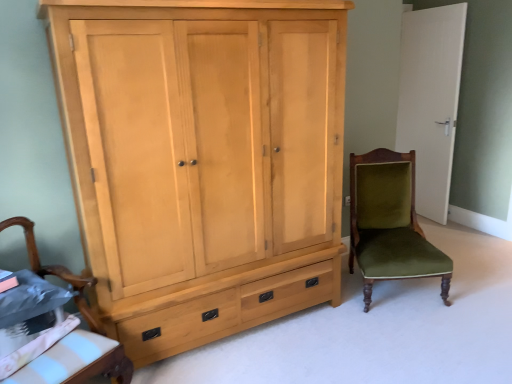
At what (x,y) coordinates should I click in order to perform the action: click on white matte door at upper right. Please return your answer as a coordinate pair (x, y). The image size is (512, 384). Looking at the image, I should click on (430, 100).

Describe the element at coordinates (203, 160) in the screenshot. The height and width of the screenshot is (384, 512). I see `light wood wardrobe at left` at that location.

The width and height of the screenshot is (512, 384). In order to click on white matte door at upper right in this screenshot , I will do `click(430, 100)`.

Looking at their sizes, would you say light wood wardrobe at left is wider or thinner than velvet green chair at right, placed as the second chair when sorted from left to right?

Clearly, light wood wardrobe at left has less width compared to velvet green chair at right, placed as the second chair when sorted from left to right.

Does light wood wardrobe at left have a greater height compared to velvet green chair at right, placed as the second chair when sorted from left to right?

Correct, light wood wardrobe at left is much taller as velvet green chair at right, placed as the second chair when sorted from left to right.

In the image, is light wood wardrobe at left positioned in front of or behind velvet green chair at right, the 1th chair positioned from the back?

In the image, light wood wardrobe at left appears in front of velvet green chair at right, the 1th chair positioned from the back.

From the image's perspective, is light wood wardrobe at left below velvet green chair at right, placed as the second chair when sorted from left to right?

No, from the image's perspective, light wood wardrobe at left is not below velvet green chair at right, placed as the second chair when sorted from left to right.

From a real-world perspective, does light wood wardrobe at left sit lower than wooden armchair at lower left, the 2th chair in the right-to-left sequence?

Incorrect, from a real-world perspective, light wood wardrobe at left is higher than wooden armchair at lower left, the 2th chair in the right-to-left sequence.

What's the angular difference between light wood wardrobe at left and wooden armchair at lower left, placed as the 2th chair when sorted from back to front,'s facing directions?

The angular difference between light wood wardrobe at left and wooden armchair at lower left, placed as the 2th chair when sorted from back to front, is 30 degrees.

Is the surface of light wood wardrobe at left in direct contact with wooden armchair at lower left, placed as the 2th chair when sorted from back to front?

light wood wardrobe at left and wooden armchair at lower left, placed as the 2th chair when sorted from back to front, are not in contact.

In the image, is light wood wardrobe at left positioned in front of or behind wooden armchair at lower left, the 2th chair in the right-to-left sequence?

Clearly, light wood wardrobe at left is behind wooden armchair at lower left, the 2th chair in the right-to-left sequence.

Considering the sizes of objects velvet green chair at right, placed as the second chair when sorted from left to right, and wooden armchair at lower left, the 2th chair in the right-to-left sequence, in the image provided, who is shorter, velvet green chair at right, placed as the second chair when sorted from left to right, or wooden armchair at lower left, the 2th chair in the right-to-left sequence,?

Standing shorter between the two is wooden armchair at lower left, the 2th chair in the right-to-left sequence.

From the image's perspective, is velvet green chair at right, the 2th chair positioned from the front, beneath wooden armchair at lower left, the 2th chair in the right-to-left sequence?

No, from the image's perspective, velvet green chair at right, the 2th chair positioned from the front, is not below wooden armchair at lower left, the 2th chair in the right-to-left sequence.

Can you confirm if velvet green chair at right, placed as the second chair when sorted from left to right, is thinner than wooden armchair at lower left, which is the first chair in left-to-right order?

Incorrect, the width of velvet green chair at right, placed as the second chair when sorted from left to right, is not less than that of wooden armchair at lower left, which is the first chair in left-to-right order.

Which object is thinner, wooden armchair at lower left, which is the first chair in left-to-right order, or light wood wardrobe at left?

wooden armchair at lower left, which is the first chair in left-to-right order, is thinner.

Considering the relative sizes of wooden armchair at lower left, positioned as the 1th chair in front-to-back order, and light wood wardrobe at left in the image provided, is wooden armchair at lower left, positioned as the 1th chair in front-to-back order, taller than light wood wardrobe at left?

No.

Would you consider wooden armchair at lower left, positioned as the 1th chair in front-to-back order, to be distant from light wood wardrobe at left?

No.

Can you confirm if velvet green chair at right, the 1th chair positioned from the back, is taller than light wood wardrobe at left?

In fact, velvet green chair at right, the 1th chair positioned from the back, may be shorter than light wood wardrobe at left.

Is velvet green chair at right, placed as the second chair when sorted from left to right, turned away from light wood wardrobe at left?

No, velvet green chair at right, placed as the second chair when sorted from left to right,'s orientation is not away from light wood wardrobe at left.

Is velvet green chair at right, placed as the second chair when sorted from left to right, to the right of light wood wardrobe at left from the viewer's perspective?

Yes, velvet green chair at right, placed as the second chair when sorted from left to right, is to the right of light wood wardrobe at left.

Visually, is white matte door at upper right positioned to the left or to the right of velvet green chair at right, the first chair when ordered from right to left?

Based on their positions, white matte door at upper right is located to the right of velvet green chair at right, the first chair when ordered from right to left.

From the picture: Is there a large distance between white matte door at upper right and velvet green chair at right, the 1th chair positioned from the back?

Yes, white matte door at upper right is far from velvet green chair at right, the 1th chair positioned from the back.

Does white matte door at upper right have a larger size compared to velvet green chair at right, the 2th chair positioned from the front?

Incorrect, white matte door at upper right is not larger than velvet green chair at right, the 2th chair positioned from the front.

From a real-world perspective, is white matte door at upper right positioned above or below velvet green chair at right, placed as the second chair when sorted from left to right?

white matte door at upper right is situated higher than velvet green chair at right, placed as the second chair when sorted from left to right, in the real world.

Locate an element on the screen. The height and width of the screenshot is (384, 512). cupboard that is under the white matte door at upper right (from a real-world perspective) is located at coordinates (203, 160).

From a real-world perspective, relative to white matte door at upper right, is light wood wardrobe at left vertically above or below?

From a real-world perspective, light wood wardrobe at left is physically below white matte door at upper right.

Based on the photo, is light wood wardrobe at left not within white matte door at upper right?

Indeed, light wood wardrobe at left is completely outside white matte door at upper right.

Is the position of light wood wardrobe at left less distant than that of white matte door at upper right?

Yes, it is.

The width and height of the screenshot is (512, 384). Find the location of `chair on the right of light wood wardrobe at left`. chair on the right of light wood wardrobe at left is located at coordinates (390, 223).

This screenshot has width=512, height=384. What are the coordinates of `the 2nd chair below when counting from the light wood wardrobe at left (from the image's perspective)` in the screenshot? It's located at (81, 314).

Estimate the real-world distances between objects in this image. Which object is further from wooden armchair at lower left, positioned as the 1th chair in front-to-back order, light wood wardrobe at left or white matte door at upper right?

white matte door at upper right is further to wooden armchair at lower left, positioned as the 1th chair in front-to-back order.

Which object lies further to the anchor point wooden armchair at lower left, positioned as the 1th chair in front-to-back order, white matte door at upper right or velvet green chair at right, the 2th chair positioned from the front?

white matte door at upper right is positioned further to the anchor wooden armchair at lower left, positioned as the 1th chair in front-to-back order.

Looking at the image, which one is located further to white matte door at upper right, velvet green chair at right, the first chair when ordered from right to left, or wooden armchair at lower left, placed as the 2th chair when sorted from back to front?

Based on the image, wooden armchair at lower left, placed as the 2th chair when sorted from back to front, appears to be further to white matte door at upper right.

Based on the photo, based on their spatial positions, is velvet green chair at right, placed as the second chair when sorted from left to right, or white matte door at upper right further from light wood wardrobe at left?

white matte door at upper right is further to light wood wardrobe at left.

From the image, which object appears to be farther from velvet green chair at right, the first chair when ordered from right to left, white matte door at upper right or wooden armchair at lower left, placed as the 2th chair when sorted from back to front?

wooden armchair at lower left, placed as the 2th chair when sorted from back to front, lies further to velvet green chair at right, the first chair when ordered from right to left, than the other object.

Which object lies further to the anchor point wooden armchair at lower left, the 2th chair in the right-to-left sequence, velvet green chair at right, the 1th chair positioned from the back, or light wood wardrobe at left?

velvet green chair at right, the 1th chair positioned from the back.

When comparing their distances from velvet green chair at right, placed as the second chair when sorted from left to right, does light wood wardrobe at left or white matte door at upper right seem closer?

light wood wardrobe at left is positioned closer to the anchor velvet green chair at right, placed as the second chair when sorted from left to right.

Estimate the real-world distances between objects in this image. Which object is further from wooden armchair at lower left, which is the first chair in left-to-right order, velvet green chair at right, the 2th chair positioned from the front, or white matte door at upper right?

Based on the image, white matte door at upper right appears to be further to wooden armchair at lower left, which is the first chair in left-to-right order.

Where is `chair located between wooden armchair at lower left, positioned as the 1th chair in front-to-back order, and white matte door at upper right in the left-right direction`? The image size is (512, 384). chair located between wooden armchair at lower left, positioned as the 1th chair in front-to-back order, and white matte door at upper right in the left-right direction is located at coordinates (390, 223).

Find the location of `cupboard located between wooden armchair at lower left, placed as the 2th chair when sorted from back to front, and velvet green chair at right, the 2th chair positioned from the front, in the left-right direction`. cupboard located between wooden armchair at lower left, placed as the 2th chair when sorted from back to front, and velvet green chair at right, the 2th chair positioned from the front, in the left-right direction is located at coordinates (203, 160).

Where is `chair situated between light wood wardrobe at left and white matte door at upper right from left to right`? The image size is (512, 384). chair situated between light wood wardrobe at left and white matte door at upper right from left to right is located at coordinates (390, 223).

This screenshot has height=384, width=512. I want to click on cupboard situated between wooden armchair at lower left, positioned as the 1th chair in front-to-back order, and white matte door at upper right from left to right, so click(x=203, y=160).